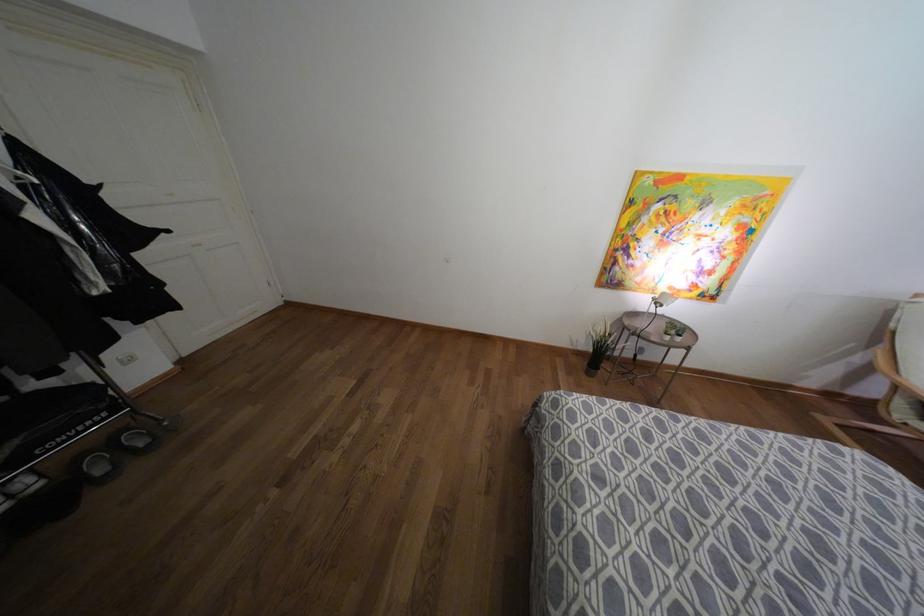
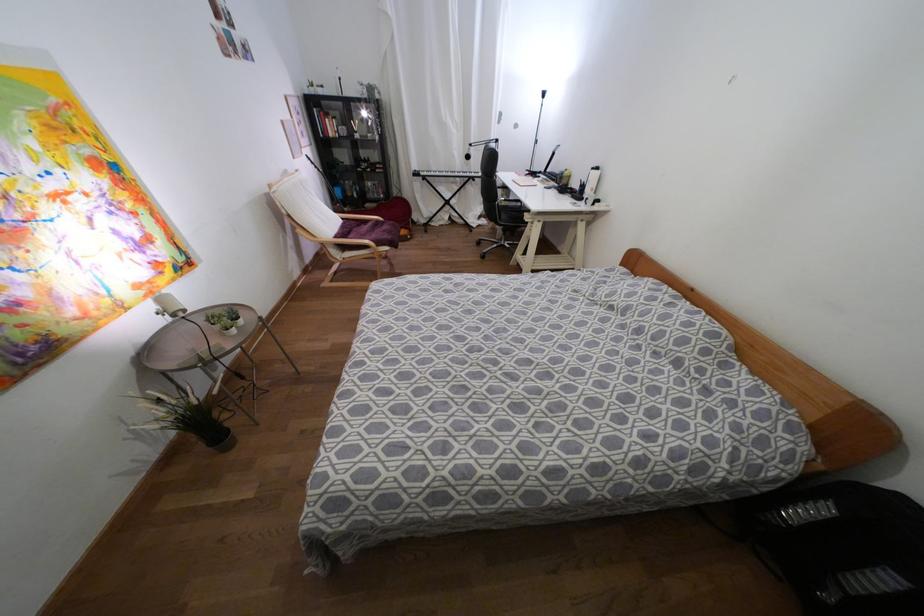
The images are taken continuously from a first-person perspective. In which direction is your viewpoint rotating?

The camera rotated toward right-down.